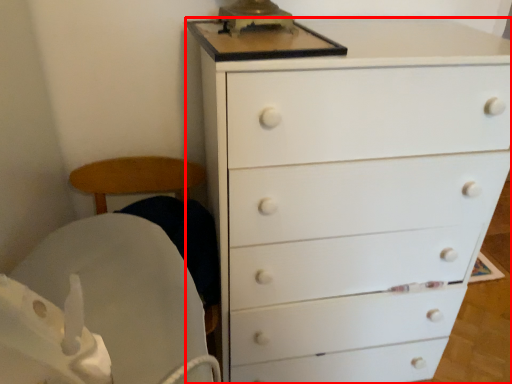
Question: From the image's perspective, what is the correct spatial positioning of chest of drawers (annotated by the red box) in reference to rocking chair?

Choices:
 (A) below
 (B) above

Answer: (B)